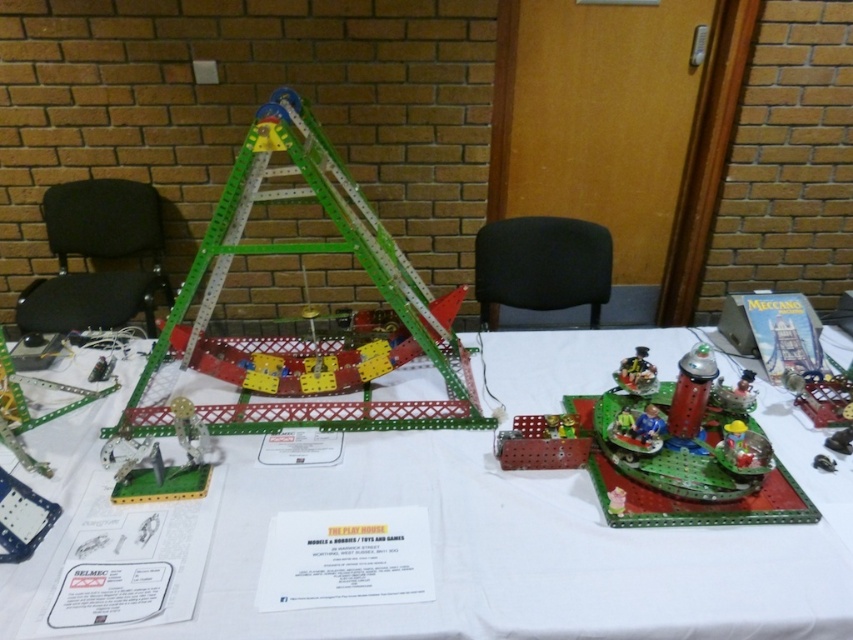
Question: Which point is closer to the camera?

Choices:
 (A) green plastic toy at center
 (B) black fabric chair at left
 (C) metallic green tower at center
 (D) black fabric chair at center

Answer: (A)

Question: Which of the following is the farthest from the observer?

Choices:
 (A) (x=418, y=422)
 (B) (x=653, y=497)

Answer: (A)

Question: Where is green plastic ladder at center located in relation to metallic green tower at center in the image?

Choices:
 (A) above
 (B) below

Answer: (A)

Question: Which object is farther from the camera taking this photo?

Choices:
 (A) green plastic table at center
 (B) green plastic toy at center

Answer: (B)

Question: Can you confirm if green plastic table at center is positioned to the left of green plastic ladder at center?

Choices:
 (A) yes
 (B) no

Answer: (B)

Question: Where is green plastic table at center located in relation to metallic green tower at center in the image?

Choices:
 (A) right
 (B) left

Answer: (B)